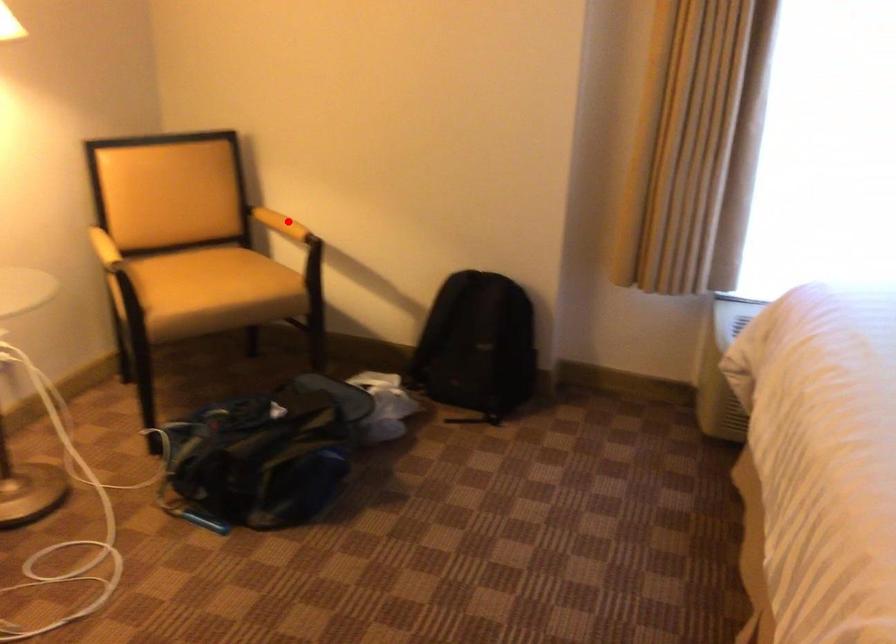
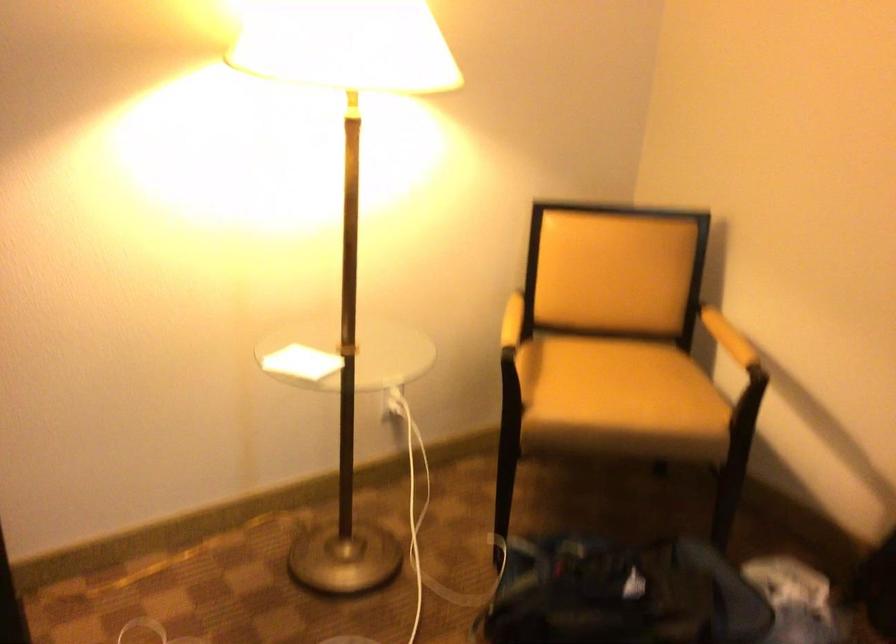
Question: A red point is marked in image1. In image2, is the corresponding 3D point closer to the camera or farther? Reply with the corresponding letter.

Choices:
 (A) The corresponding 3D point is closer.
 (B) The corresponding 3D point is farther.

Answer: (A)